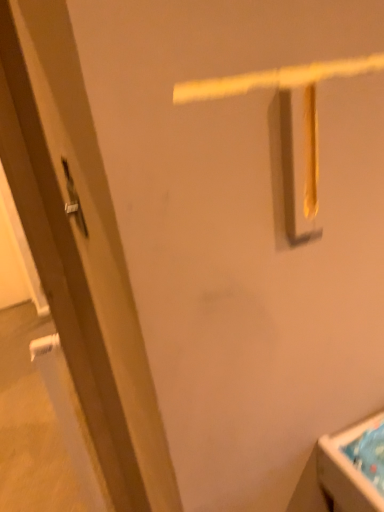
Find the location of a particular element. white glossy sink at lower right is located at coordinates (354, 466).

Find the location of a particular element. matte brown door at left is located at coordinates (80, 250).

The height and width of the screenshot is (512, 384). What are the coordinates of `satin silver door handle at left` in the screenshot? It's located at tap(73, 200).

Consider the image. Can you confirm if white glossy sink at lower right is taller than matte brown door at left?

No.

Is white glossy sink at lower right wider than matte brown door at left?

Correct, the width of white glossy sink at lower right exceeds that of matte brown door at left.

Is white glossy sink at lower right not within matte brown door at left?

Yes, white glossy sink at lower right is outside of matte brown door at left.

What's the angular difference between white glossy sink at lower right and matte brown door at left's facing directions?

white glossy sink at lower right and matte brown door at left are facing 88.5 degrees away from each other.

In the scene shown: From a real-world perspective, is satin silver door handle at left positioned under matte brown door at left based on gravity?

No, from a real-world perspective, satin silver door handle at left is not beneath matte brown door at left.

Considering the positions of objects satin silver door handle at left and matte brown door at left in the image provided, who is more to the left, satin silver door handle at left or matte brown door at left?

satin silver door handle at left.

Is satin silver door handle at left bigger or smaller than matte brown door at left?

Considering their sizes, satin silver door handle at left takes up less space than matte brown door at left.

Is there a large distance between satin silver door handle at left and matte brown door at left?

satin silver door handle at left is actually quite close to matte brown door at left.

Can you confirm if matte brown door at left is wider than satin silver door handle at left?

Correct, the width of matte brown door at left exceeds that of satin silver door handle at left.

Which object is closer to the camera, matte brown door at left or satin silver door handle at left?

matte brown door at left is more forward.

Is matte brown door at left bigger than satin silver door handle at left?

Indeed, matte brown door at left has a larger size compared to satin silver door handle at left.

From the image's perspective, does matte brown door at left appear lower than satin silver door handle at left?

Yes, from the image's perspective, matte brown door at left is below satin silver door handle at left.

Which object is positioned more to the left, white glossy sink at lower right or satin silver door handle at left?

From the viewer's perspective, satin silver door handle at left appears more on the left side.

Does white glossy sink at lower right contain satin silver door handle at left?

That's incorrect, satin silver door handle at left is not inside white glossy sink at lower right.

I want to click on door handle above the white glossy sink at lower right (from the image's perspective), so click(73, 200).

Considering the positions of objects matte brown door at left and white glossy sink at lower right in the image provided, who is more to the left, matte brown door at left or white glossy sink at lower right?

matte brown door at left is more to the left.

Is matte brown door at left aimed at white glossy sink at lower right?

No, matte brown door at left is not turned towards white glossy sink at lower right.

Is point (37, 2) positioned behind point (333, 475)?

No, it is not.

Does satin silver door handle at left have a lesser width compared to white glossy sink at lower right?

Indeed, satin silver door handle at left has a lesser width compared to white glossy sink at lower right.

From the image's perspective, is satin silver door handle at left beneath white glossy sink at lower right?

Actually, satin silver door handle at left appears above white glossy sink at lower right in the image.

Find the location of a particular element. This screenshot has height=512, width=384. sink that appears below the satin silver door handle at left (from the image's perspective) is located at coordinates (354, 466).

Between satin silver door handle at left and white glossy sink at lower right, which one appears on the left side from the viewer's perspective?

From the viewer's perspective, satin silver door handle at left appears more on the left side.

The width and height of the screenshot is (384, 512). Identify the location of sink below the matte brown door at left (from a real-world perspective). (354, 466).

You are a GUI agent. You are given a task and a screenshot of the screen. Output one action in this format:
    pyautogui.click(x=<x>, y=<y>)
    Task: Click on the door handle lying on the left of matte brown door at left
    This screenshot has height=512, width=384.
    Given the screenshot: What is the action you would take?
    pyautogui.click(x=73, y=200)

Considering their positions, is satin silver door handle at left positioned closer to matte brown door at left than white glossy sink at lower right?

Among the two, satin silver door handle at left is located nearer to matte brown door at left.

Estimate the real-world distances between objects in this image. Which object is closer to white glossy sink at lower right, matte brown door at left or satin silver door handle at left?

matte brown door at left.

Estimate the real-world distances between objects in this image. Which object is further from satin silver door handle at left, white glossy sink at lower right or matte brown door at left?

white glossy sink at lower right.

Looking at the image, which one is located closer to matte brown door at left, white glossy sink at lower right or satin silver door handle at left?

satin silver door handle at left lies closer to matte brown door at left than the other object.

Which object lies nearer to the anchor point satin silver door handle at left, matte brown door at left or white glossy sink at lower right?

matte brown door at left lies closer to satin silver door handle at left than the other object.

Which object lies further to the anchor point white glossy sink at lower right, satin silver door handle at left or matte brown door at left?

The object further to white glossy sink at lower right is satin silver door handle at left.

The image size is (384, 512). Identify the location of door located between satin silver door handle at left and white glossy sink at lower right in the left-right direction. (80, 250).